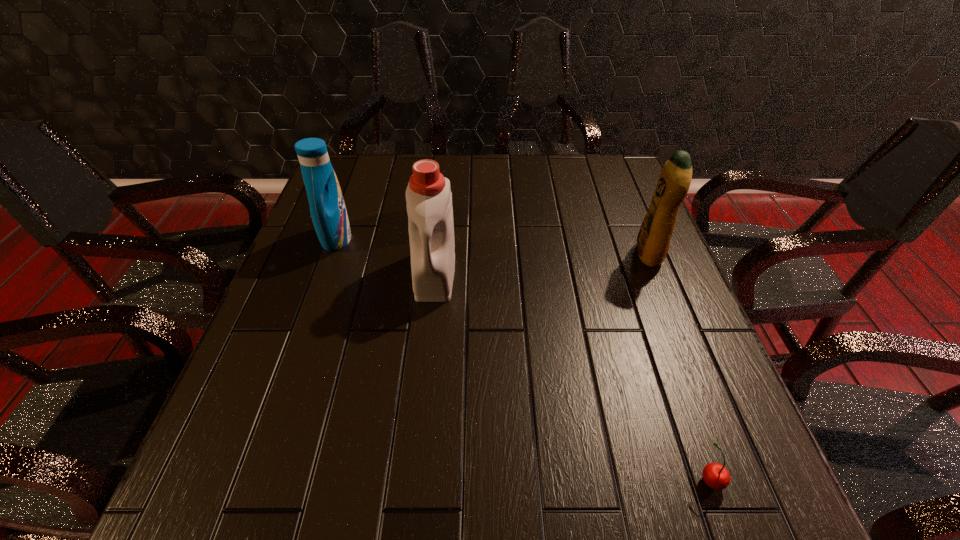
Where is `free space located 0.230m on the left of the shortest object`? free space located 0.230m on the left of the shortest object is located at coordinates (558, 479).

Image resolution: width=960 pixels, height=540 pixels. Identify the location of object situated at the near edge. (715, 475).

Find the location of a particular element. This screenshot has width=960, height=540. object that is at the left edge is located at coordinates (328, 211).

Identify the location of detergent located in the right edge section of the desktop. Image resolution: width=960 pixels, height=540 pixels. (653, 240).

Where is `cherry at the right edge`? The height and width of the screenshot is (540, 960). cherry at the right edge is located at coordinates (715, 475).

Locate an element on the screen. The image size is (960, 540). object at the near right corner is located at coordinates point(715,475).

Identify the location of blank space at the far edge. The height and width of the screenshot is (540, 960). (381, 185).

Where is `vacant space at the near edge of the desktop`? This screenshot has width=960, height=540. vacant space at the near edge of the desktop is located at coordinates (582, 471).

Image resolution: width=960 pixels, height=540 pixels. In the image, there is a desktop. In order to click on blank space at the left edge in this screenshot , I will do `click(299, 291)`.

Locate an element on the screen. This screenshot has width=960, height=540. vacant space at the right edge of the desktop is located at coordinates (620, 252).